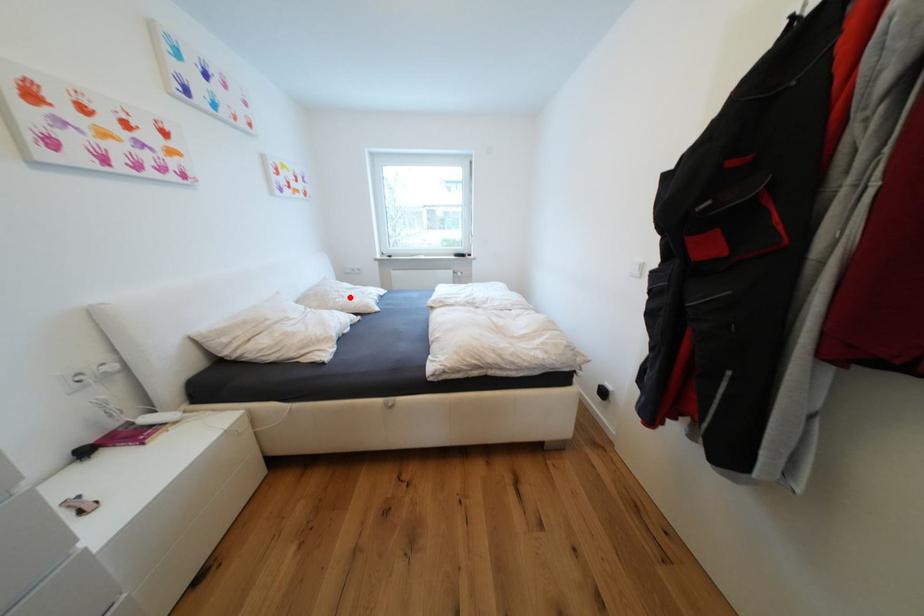
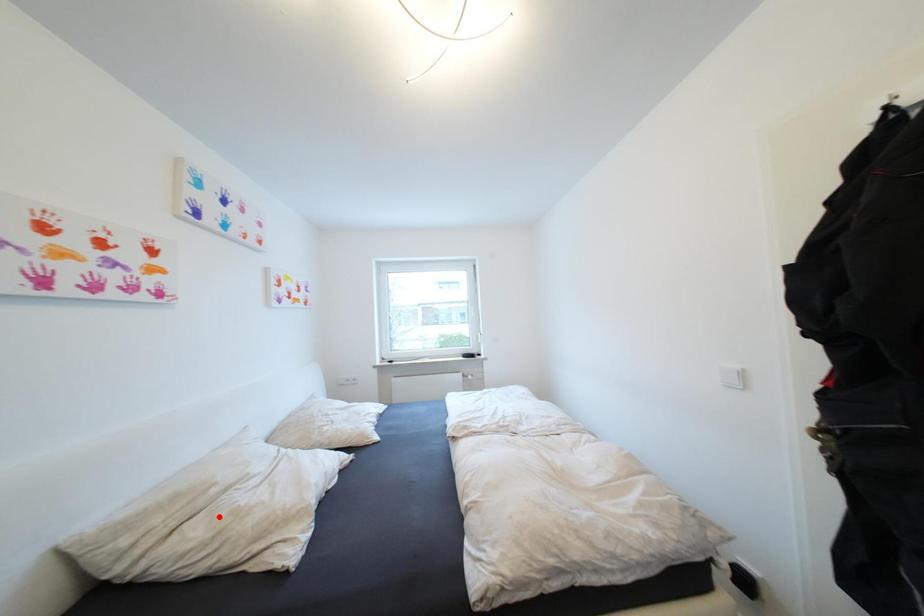
From the picture: I am providing you with two images of the same scene from different viewpoints. A red point is marked on the first image and another point is marked on the second image. Are the points marked in image1 and image2 representing the same 3D position?

No